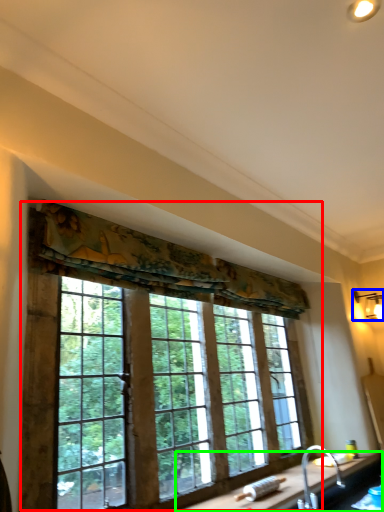
Question: Which object is the farthest from window (highlighted by a red box)? Choose among these: light fixture (highlighted by a blue box) or counter top (highlighted by a green box).

Choices:
 (A) light fixture
 (B) counter top

Answer: (A)